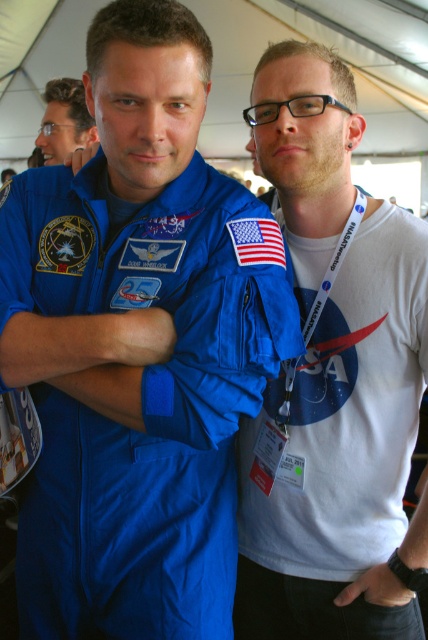
You are a photographer at a NASA event. You need to capture a photo of the matte blue jumpsuit at left and the blue fabric astronaut suit at center. The camera you are using has a minimum focus distance of 10 inches. Can you take the photo without moving either subject?

The distance between the matte blue jumpsuit at left and the blue fabric astronaut suit at center is 9.70 inches, which is less than the camera minimum focus distance of 10 inches. Therefore, you cannot take the photo without moving either subject.

Based on the scene description, which object is wider, the matte blue jumpsuit at left or the matte black hair at upper left?

The matte blue jumpsuit at left is wider than the matte black hair at upper left according to the description.

You are attending a NASA event and see two people in space theme outfits. The first is wearing a matte blue jumpsuit at left, and the second is in a blue fabric astronaut suit at center. Which one is positioned more to the left side?

The matte blue jumpsuit at left is positioned more to the left side than the blue fabric astronaut suit at center.